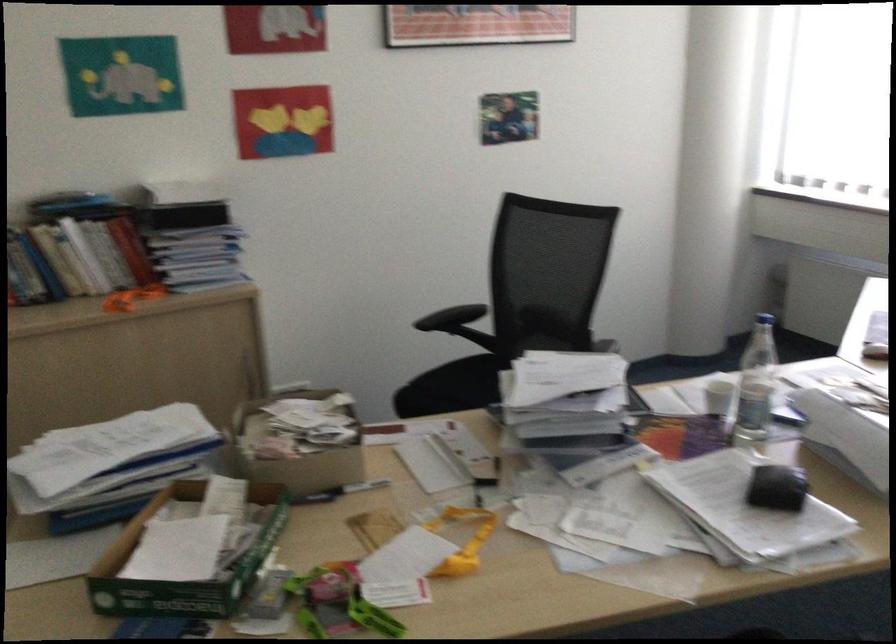
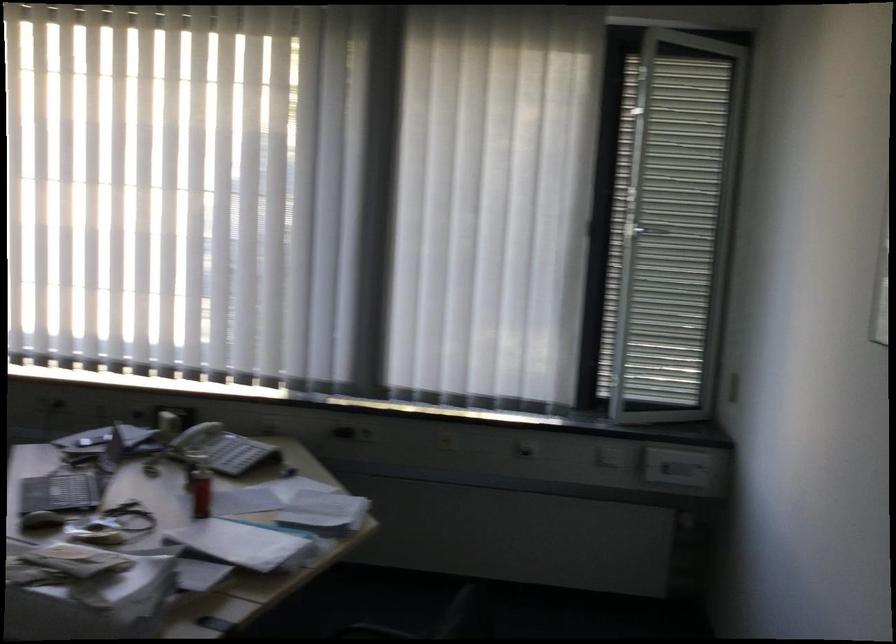
Question: The first image is from the beginning of the video and the second image is from the end. How did the camera likely rotate when shooting the video?

Choices:
 (A) Left
 (B) Right
 (C) Up
 (D) Down

Answer: (B)